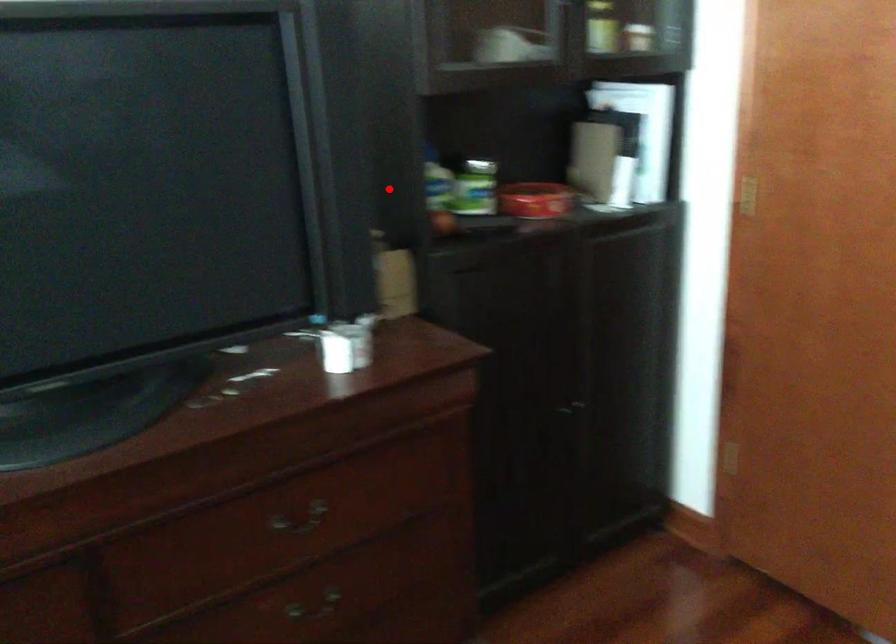
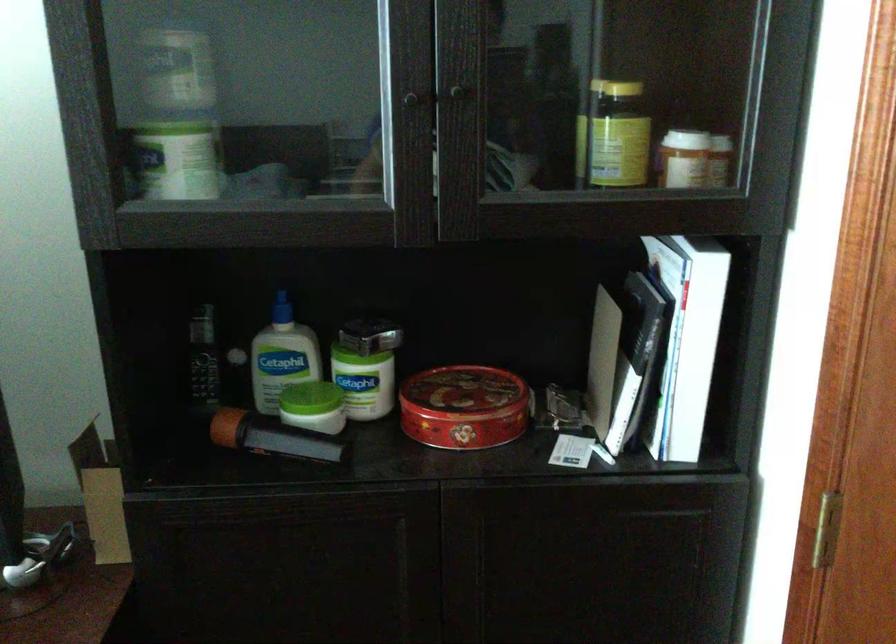
Question: I am providing you with two images of the same scene from different viewpoints. Given a red point in image1, look at the same physical point in image2. Is it:

Choices:
 (A) Closer to the viewpoint
 (B) Farther from the viewpoint

Answer: (A)